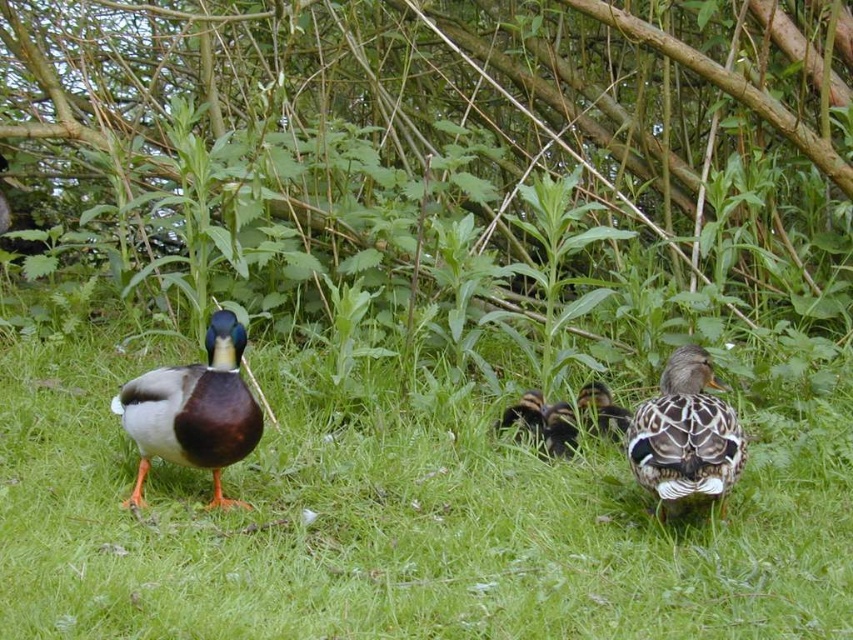
Describe the element at coordinates (194, 410) in the screenshot. I see `shiny brown duck at left` at that location.

Identify the location of shiny brown duck at left. This screenshot has width=853, height=640. (194, 410).

Find the location of a particular element. shiny brown duck at left is located at coordinates (194, 410).

Who is positioned more to the left, shiny brown duck at left or speckled brown duckling at center?

Positioned to the left is shiny brown duck at left.

Where is `shiny brown duck at left`? This screenshot has width=853, height=640. shiny brown duck at left is located at coordinates (194, 410).

Does point (132, 380) lie behind point (601, 424)?

No, it is in front of (601, 424).

Where is `shiny brown duck at left`? The image size is (853, 640). shiny brown duck at left is located at coordinates (194, 410).

Is speckled feathered duck at right to the left of speckled brown duckling at center from the viewer's perspective?

No, speckled feathered duck at right is not to the left of speckled brown duckling at center.

Who is shorter, speckled feathered duck at right or speckled brown duckling at center?

Standing shorter between the two is speckled brown duckling at center.

The width and height of the screenshot is (853, 640). Describe the element at coordinates (685, 435) in the screenshot. I see `speckled feathered duck at right` at that location.

Locate an element on the screen. The height and width of the screenshot is (640, 853). speckled feathered duck at right is located at coordinates (685, 435).